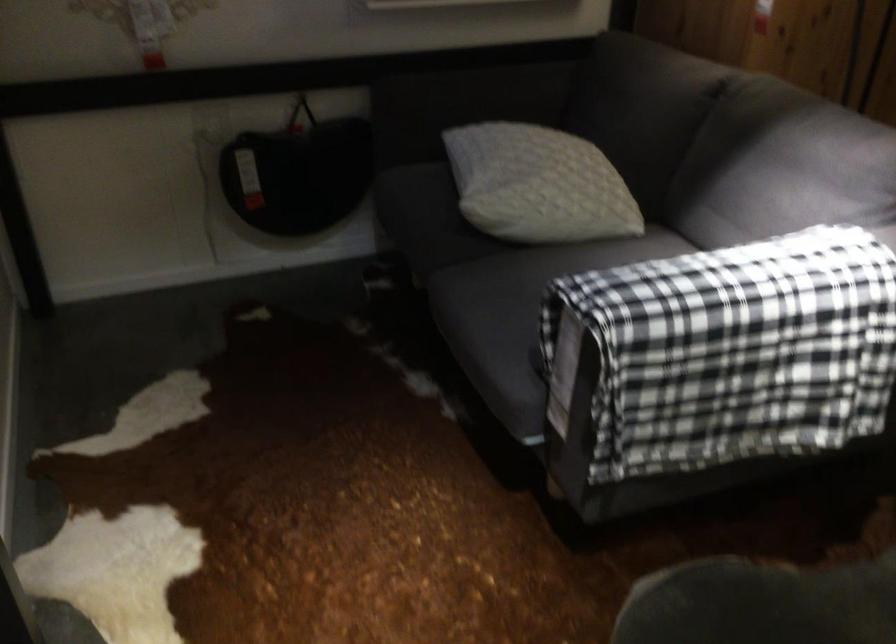
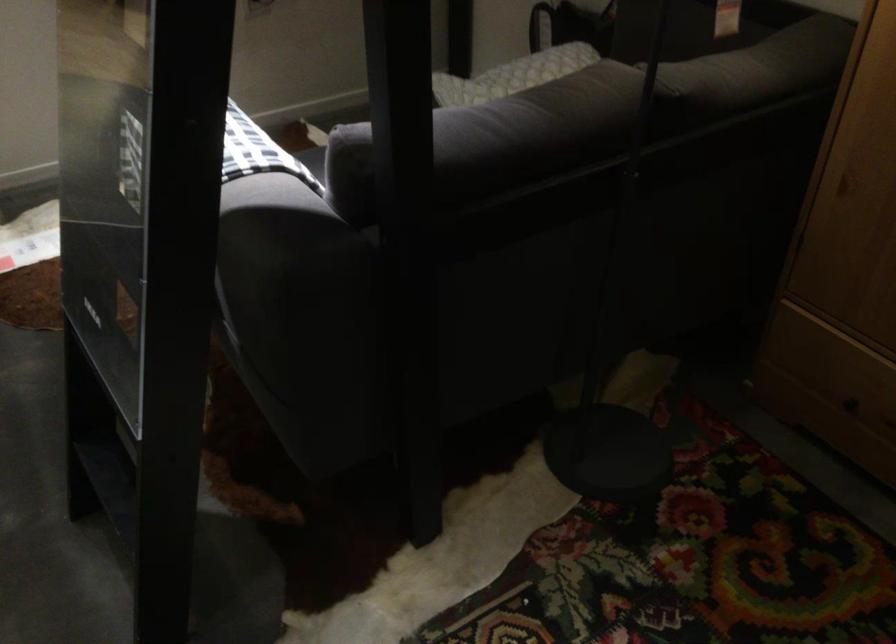
Question: I am providing you with two images of the same scene from different viewpoints. After the viewpoint changes to image2, which objects are now occluded?

Choices:
 (A) sofa sitting surface
 (B) grey back cushion
 (C) sofa armrest
 (D) whiteboard on stand

Answer: (A)